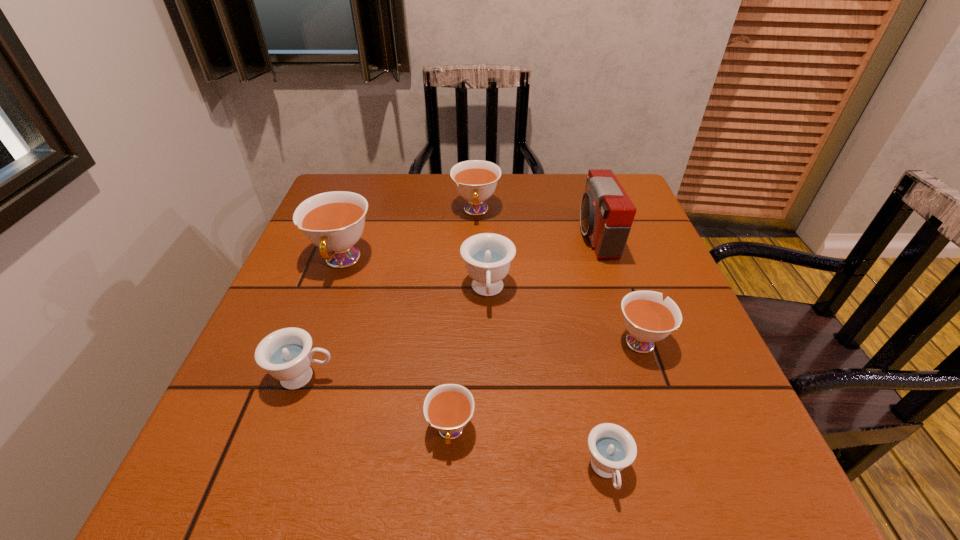
Locate an element on the screen. vacant space positioned on the side of the rightmost teacup with the handle is located at coordinates (602, 233).

Where is `blank area located 0.330m on the side of the rightmost teacup with the handle`? blank area located 0.330m on the side of the rightmost teacup with the handle is located at coordinates click(599, 224).

What are the coordinates of `vacant area situated 0.320m on the side of the rightmost teacup with the handle` in the screenshot? It's located at (600, 226).

I want to click on free location located on the side of the leftmost blue teacup with the handle, so click(455, 377).

Where is `camera at the far edge`? This screenshot has width=960, height=540. camera at the far edge is located at coordinates (606, 213).

Identify the location of teacup present at the far edge. This screenshot has height=540, width=960. (475, 180).

Locate an element on the screen. The width and height of the screenshot is (960, 540). camera that is at the right edge is located at coordinates (606, 213).

Locate an element on the screen. teacup that is at the right edge is located at coordinates (648, 319).

Where is `object present at the far right corner`? This screenshot has width=960, height=540. object present at the far right corner is located at coordinates (606, 213).

What are the coordinates of `vacant space at the far edge of the desktop` in the screenshot? It's located at pos(483,214).